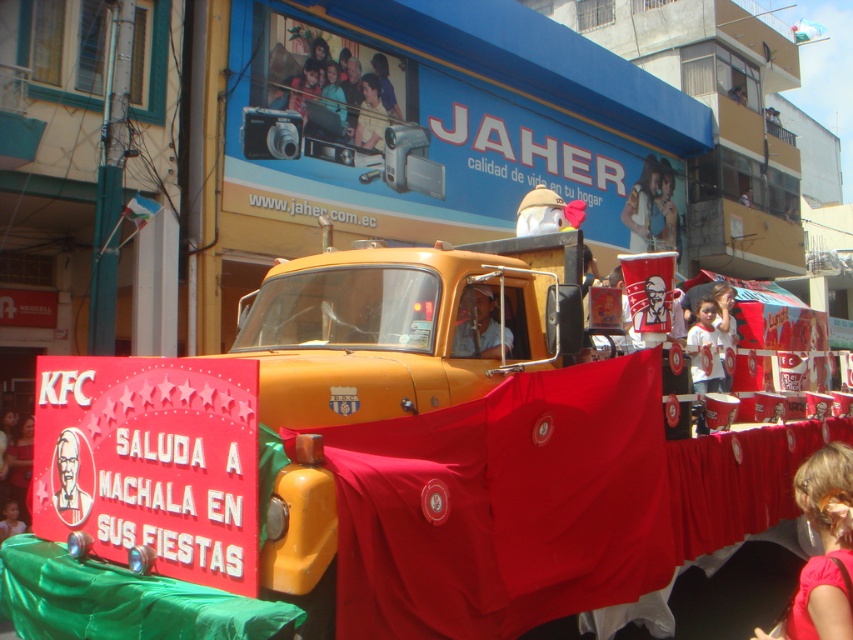
Question: Can you confirm if matte black laptop at upper center is positioned to the left of blonde hair at lower right?

Choices:
 (A) no
 (B) yes

Answer: (B)

Question: Which object is closer to the camera taking this photo?

Choices:
 (A) white paper cup at center
 (B) yellow plastic camera at upper center
 (C) blonde hair at lower right

Answer: (C)

Question: Does smooth plastic cup at upper center appear over white paper cup at center?

Choices:
 (A) yes
 (B) no

Answer: (A)

Question: Which object is the closest to the smooth plastic cup at upper center?

Choices:
 (A) smooth plastic kfc logo at center
 (B) blonde hair at lower right
 (C) white paper cup at center

Answer: (C)

Question: Which of the following is the farthest from the observer?

Choices:
 (A) coord(657,170)
 (B) coord(21,531)
 (C) coord(788,630)
 (D) coord(83,452)

Answer: (A)

Question: Can you confirm if matte black laptop at upper center is thinner than smooth plastic cup at upper center?

Choices:
 (A) yes
 (B) no

Answer: (B)